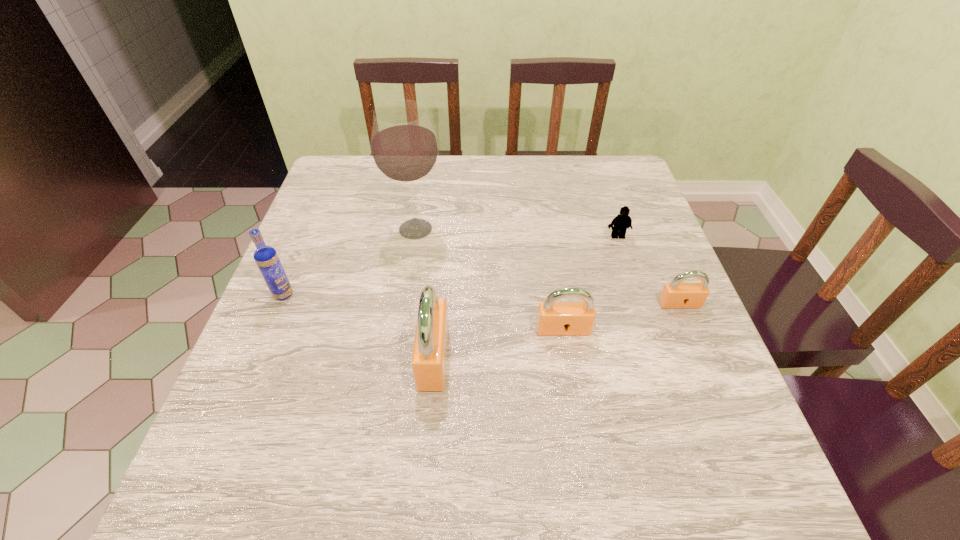
The width and height of the screenshot is (960, 540). Find the location of `vacant region that satisfies the following two spatial constraints: 1. to unlock the third shortest object from the front; 2. to unlock the tallest padlock from the front`. vacant region that satisfies the following two spatial constraints: 1. to unlock the third shortest object from the front; 2. to unlock the tallest padlock from the front is located at coordinates (567, 357).

Where is `vacant point that satisfies the following two spatial constraints: 1. on the face of the Lego; 2. to unlock the tallest padlock from the front`? This screenshot has height=540, width=960. vacant point that satisfies the following two spatial constraints: 1. on the face of the Lego; 2. to unlock the tallest padlock from the front is located at coordinates (658, 357).

What are the coordinates of `vacant space that satisfies the following two spatial constraints: 1. to unlock the third object from right to left from the front; 2. to unlock the leftmost padlock from the front` in the screenshot? It's located at (567, 357).